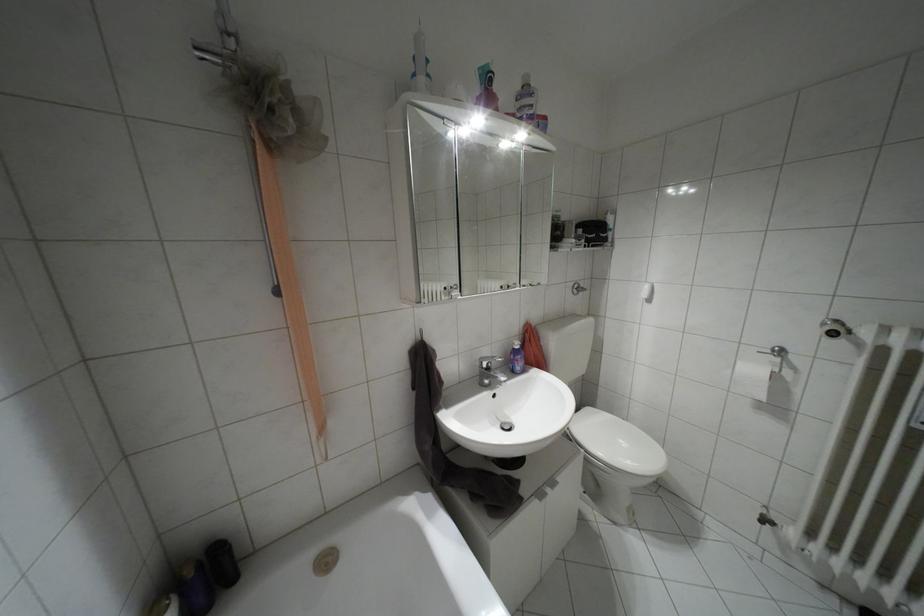
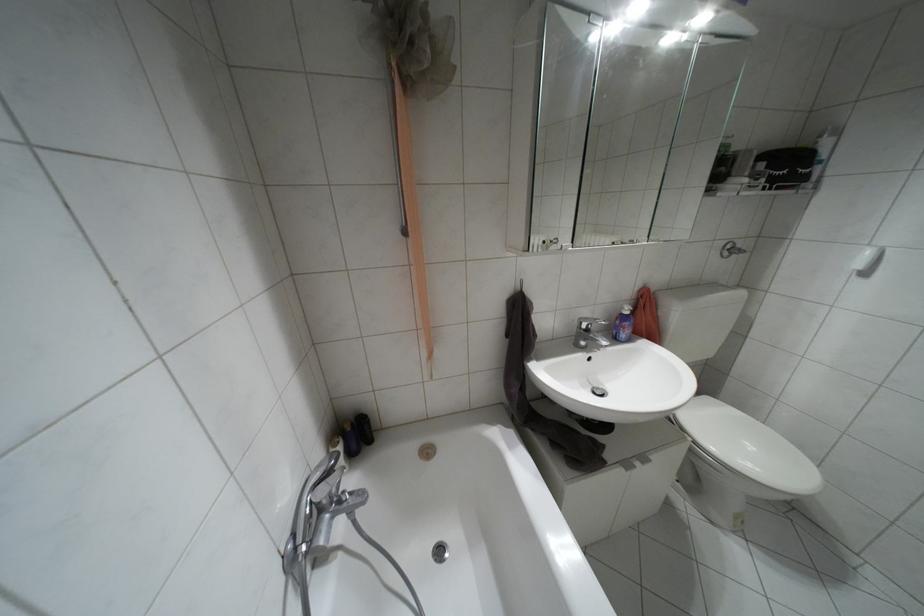
Find the pixel in the second image that matches (x=517, y=346) in the first image.

(626, 312)